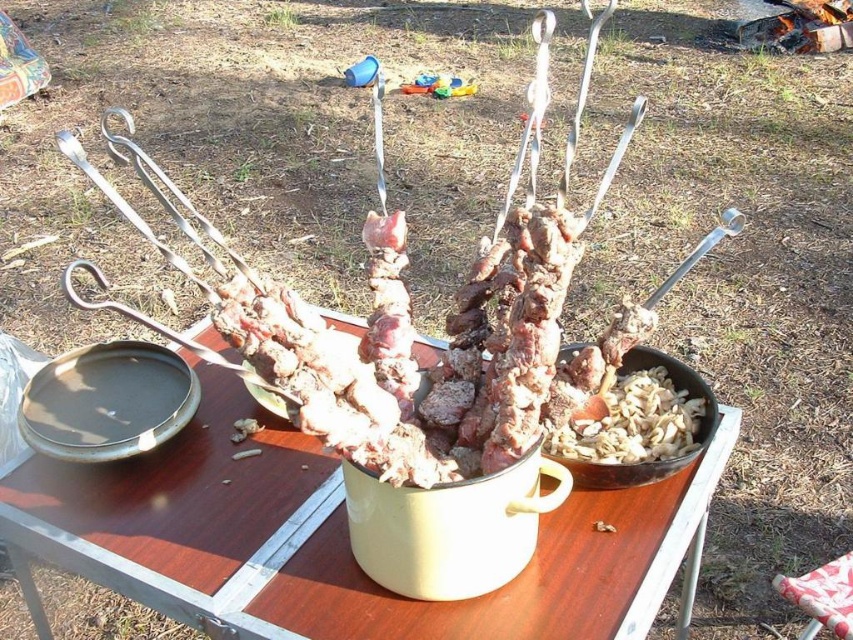
Question: Is white glossy table at center further to the viewer compared to plastic red stool at lower right?

Choices:
 (A) yes
 (B) no

Answer: (B)

Question: Which of the following is the closest to the observer?

Choices:
 (A) white glossy table at center
 (B) plastic red stool at lower right

Answer: (A)

Question: Which of the following is the closest to the observer?

Choices:
 (A) plastic red stool at lower right
 (B) white glossy table at center

Answer: (B)

Question: Is white glossy table at center above plastic red stool at lower right?

Choices:
 (A) yes
 (B) no

Answer: (A)

Question: Is white glossy table at center smaller than plastic red stool at lower right?

Choices:
 (A) yes
 (B) no

Answer: (B)